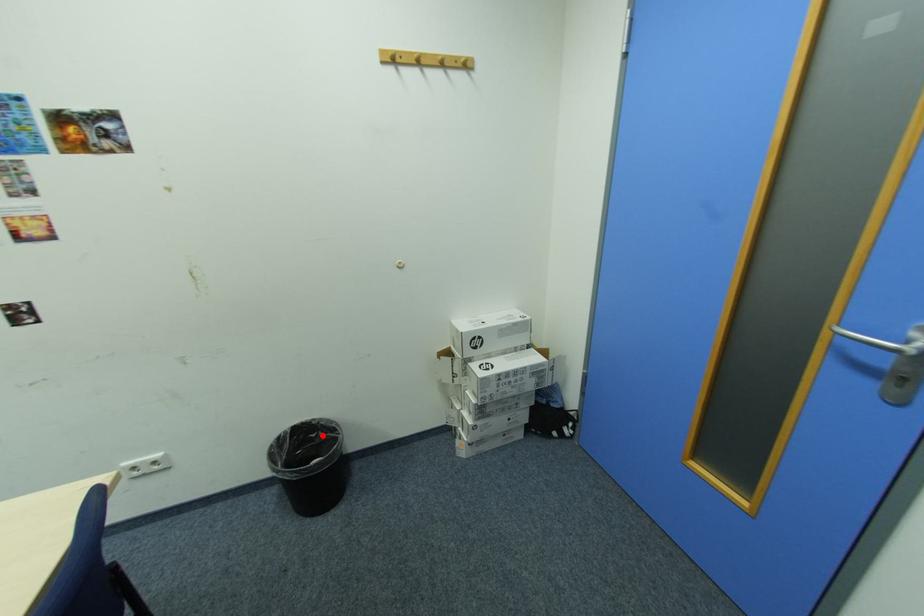
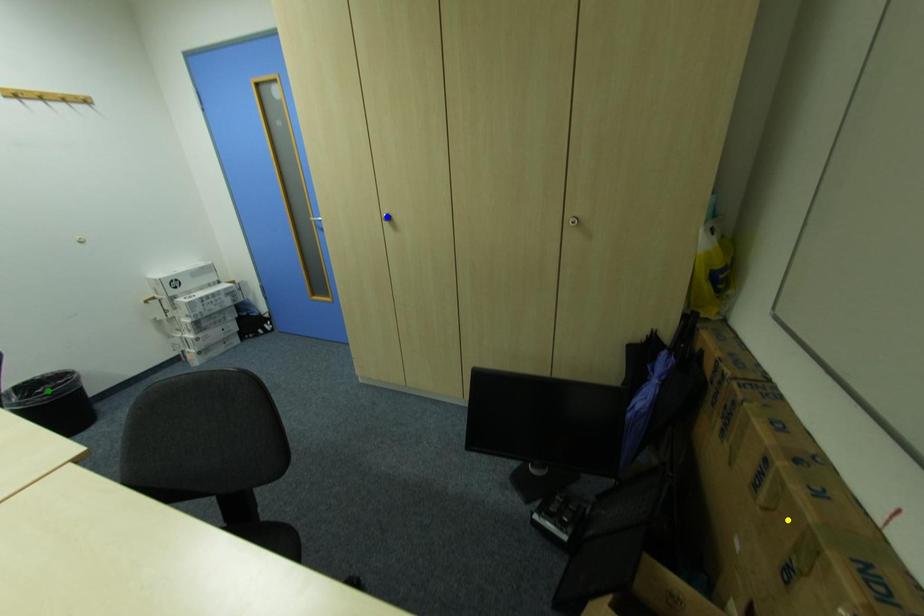
Question: I am providing you with two images of the same scene from different viewpoints. A red point is marked on the first image. You are given multiple points on the second image. Can you choose the point in image 2 that corresponds to the point in image 1?

Choices:
 (A) yellow point
 (B) blue point
 (C) green point

Answer: (C)